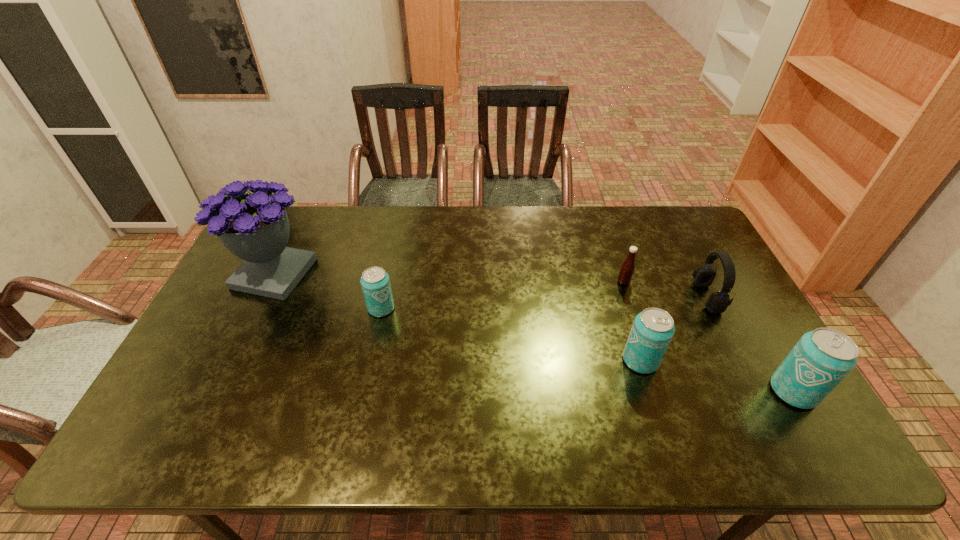
You are a GUI agent. You are given a task and a screenshot of the screen. Output one action in this format:
    pyautogui.click(x=<x>, y=<y>)
    Task: Click on the headset that is at the right edge
    This screenshot has height=540, width=960.
    Given the screenshot: What is the action you would take?
    pyautogui.click(x=717, y=302)

In order to click on object located at the far left corner in this screenshot , I will do `click(255, 227)`.

The height and width of the screenshot is (540, 960). What are the coordinates of `object positioned at the near right corner` in the screenshot? It's located at (821, 359).

Where is `free location at the far edge of the desktop`? free location at the far edge of the desktop is located at coordinates (471, 230).

This screenshot has width=960, height=540. In order to click on vacant space at the near edge of the desktop in this screenshot , I will do `click(259, 395)`.

At what (x,y) coordinates should I click in order to perform the action: click on free space at the left edge of the desktop. Please return your answer as a coordinate pair (x, y). Looking at the image, I should click on (247, 329).

Locate an element on the screen. This screenshot has width=960, height=540. vacant space at the right edge of the desktop is located at coordinates (748, 368).

What are the coordinates of `vacant space at the far left corner of the desktop` in the screenshot? It's located at [x=293, y=223].

The height and width of the screenshot is (540, 960). I want to click on free space between the bouquet and the second object from right to left, so click(x=491, y=285).

Locate an element on the screen. free space between the rightmost beer can and the farthest beer can is located at coordinates (588, 349).